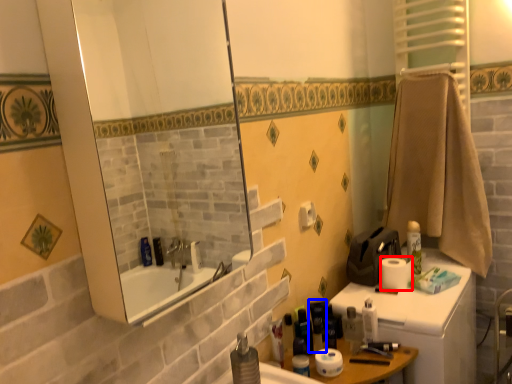
Question: Which object is closer to the camera taking this photo, toilet paper (highlighted by a red box) or toiletry (highlighted by a blue box)?

Choices:
 (A) toilet paper
 (B) toiletry

Answer: (B)